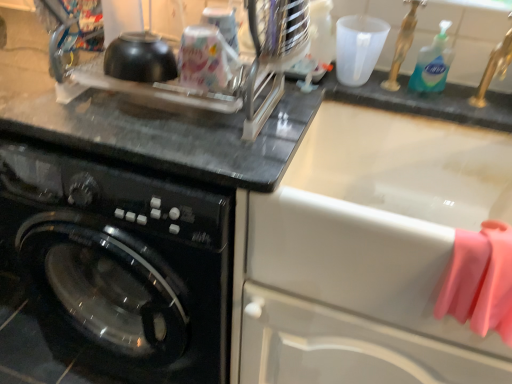
Where is `free spot in front of blue liquid soap at upper right`? The image size is (512, 384). free spot in front of blue liquid soap at upper right is located at coordinates (442, 102).